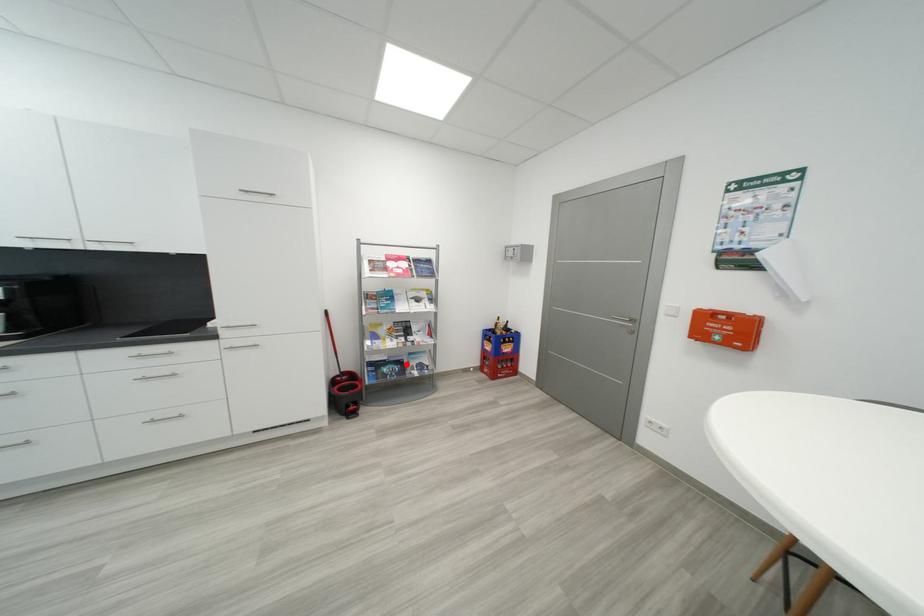
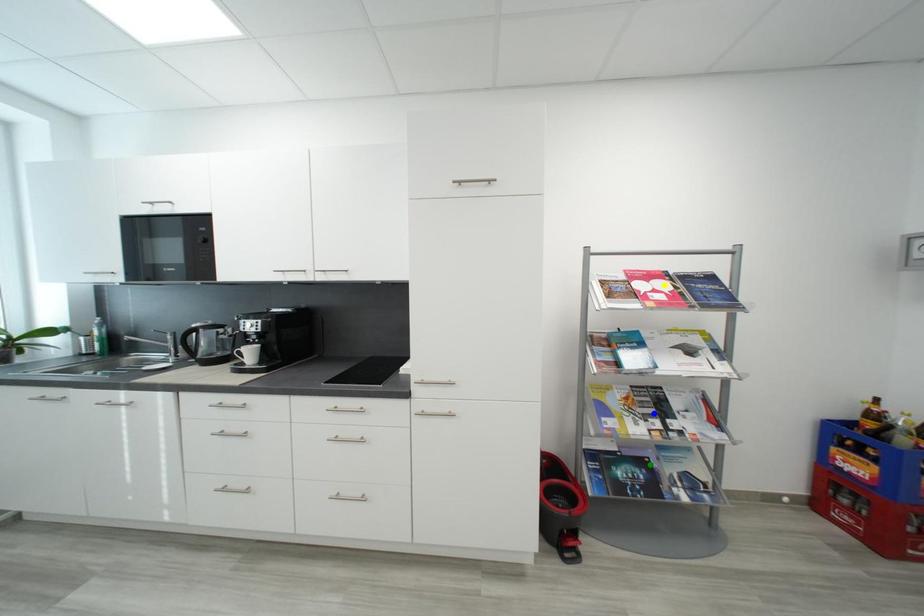
Question: I am providing you with two images of the same scene from different viewpoints. A red point is marked on the first image. You are given multiple points on the second image. In image 2, which mark is for the same physical point as the one in image 1?

Choices:
 (A) green point
 (B) blue point
 (C) yellow point

Answer: (A)